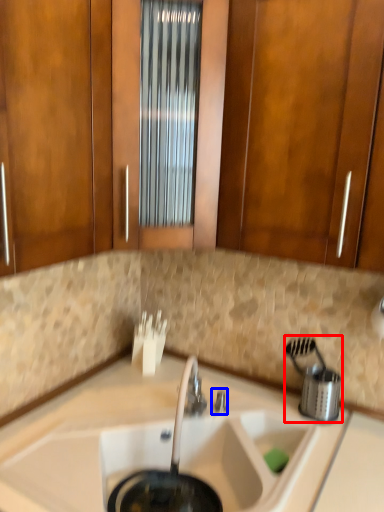
Question: Among these objects, which one is nearest to the camera, appliance (highlighted by a red box) or faucet (highlighted by a blue box)?

Choices:
 (A) appliance
 (B) faucet

Answer: (A)